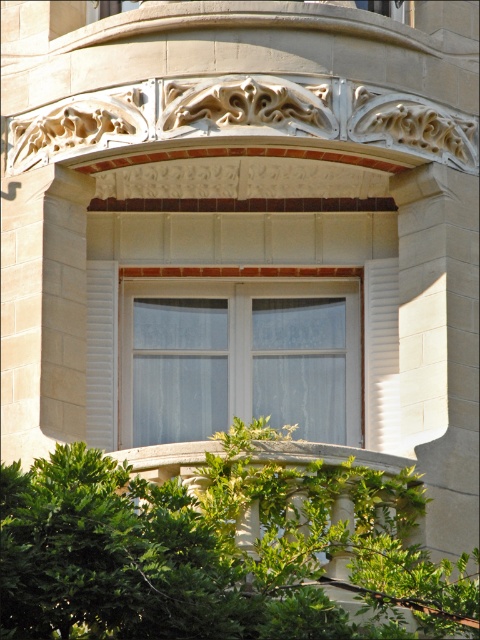
Question: Which of the following is the farthest from the observer?

Choices:
 (A) green leafy bush at lower center
 (B) white glass window at center

Answer: (B)

Question: Does green leafy bush at lower center have a larger size compared to white glass window at center?

Choices:
 (A) no
 (B) yes

Answer: (B)

Question: Which object is closer to the camera taking this photo?

Choices:
 (A) green leafy bush at lower center
 (B) white glass window at center

Answer: (A)

Question: Which of the following is the closest to the observer?

Choices:
 (A) white glass window at center
 (B) green leafy bush at lower center

Answer: (B)

Question: Is green leafy bush at lower center closer to camera compared to white glass window at center?

Choices:
 (A) no
 (B) yes

Answer: (B)

Question: Can you confirm if green leafy bush at lower center is smaller than white glass window at center?

Choices:
 (A) no
 (B) yes

Answer: (A)